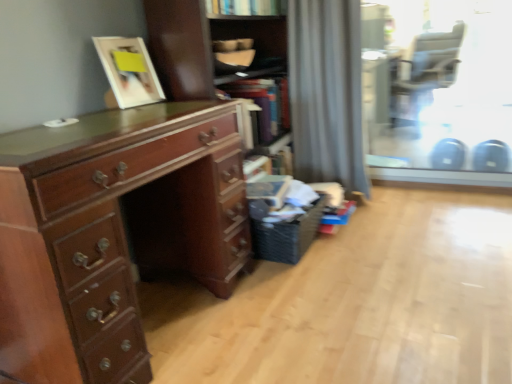
In order to click on matte black armchair at upper right in this screenshot , I will do `click(423, 73)`.

I want to click on shiny brown wooden desk at left, so click(112, 232).

Where is `transparent glass door at upper right`? transparent glass door at upper right is located at coordinates (438, 84).

Describe the element at coordinates (438, 84) in the screenshot. I see `transparent glass door at upper right` at that location.

Find the location of a particular element. The height and width of the screenshot is (384, 512). matte black armchair at upper right is located at coordinates (423, 73).

How many degrees apart are the facing directions of transparent glass door at upper right and gray fabric curtain at center?

The facing directions of transparent glass door at upper right and gray fabric curtain at center are 1.11 degrees apart.

Which is in front, transparent glass door at upper right or gray fabric curtain at center?

gray fabric curtain at center is more forward.

Is transparent glass door at upper right facing towards gray fabric curtain at center?

Yes, transparent glass door at upper right faces towards gray fabric curtain at center.

Between matte black armchair at upper right and transparent glass door at upper right, which one has smaller size?

Smaller between the two is transparent glass door at upper right.

Can you confirm if matte black armchair at upper right is thinner than transparent glass door at upper right?

No, matte black armchair at upper right is not thinner than transparent glass door at upper right.

Can you see matte black armchair at upper right touching transparent glass door at upper right?

matte black armchair at upper right is not next to transparent glass door at upper right, and they're not touching.

Who is smaller, gray fabric curtain at center or matte black armchair at upper right?

gray fabric curtain at center is smaller.

Which is more to the right, gray fabric curtain at center or matte black armchair at upper right?

matte black armchair at upper right.

Is gray fabric curtain at center far away from matte black armchair at upper right?

gray fabric curtain at center is far away from matte black armchair at upper right.

From a real-world perspective, between matte white picture frame at upper left and black woven laundry basket at lower right, who is vertically higher?

matte white picture frame at upper left is physically above.

Could you measure the distance between matte white picture frame at upper left and black woven laundry basket at lower right?

30.94 inches.

Relative to black woven laundry basket at lower right, is matte white picture frame at upper left in front or behind?

In the image, matte white picture frame at upper left appears in front of black woven laundry basket at lower right.

Can you tell me how much matte white picture frame at upper left and black woven laundry basket at lower right differ in facing direction?

There is a 9.55-degree angle between the facing directions of matte white picture frame at upper left and black woven laundry basket at lower right.

Would you say matte white picture frame at upper left is outside shiny brown wooden desk at left?

matte white picture frame at upper left lies outside shiny brown wooden desk at left's area.

What's the angular difference between matte white picture frame at upper left and shiny brown wooden desk at left's facing directions?

matte white picture frame at upper left and shiny brown wooden desk at left are facing 7.91 degrees away from each other.

Is matte white picture frame at upper left oriented away from shiny brown wooden desk at left?

No, matte white picture frame at upper left is not facing the opposite direction of shiny brown wooden desk at left.

Would you say matte white picture frame at upper left is a long distance from shiny brown wooden desk at left?

matte white picture frame at upper left is actually quite close to shiny brown wooden desk at left.

Can you confirm if wooden cabinet at center is wider than matte black armchair at upper right?

No, wooden cabinet at center is not wider than matte black armchair at upper right.

From a real-world perspective, which object rests below the other?

matte black armchair at upper right, from a real-world perspective.

Which is behind, wooden cabinet at center or matte black armchair at upper right?

matte black armchair at upper right is further from the camera.

Considering the positions of objects wooden cabinet at center and matte black armchair at upper right in the image provided, who is more to the right, wooden cabinet at center or matte black armchair at upper right?

matte black armchair at upper right is more to the right.

From a real-world perspective, relative to matte white picture frame at upper left, is wooden cabinet at center vertically above or below?

wooden cabinet at center is situated lower than matte white picture frame at upper left in the real world.

Is matte white picture frame at upper left surrounded by wooden cabinet at center?

Actually, matte white picture frame at upper left is outside wooden cabinet at center.

Which object is further away from the camera taking this photo, wooden cabinet at center or matte white picture frame at upper left?

wooden cabinet at center is further from the camera.

Identify the location of glass door behind the gray fabric curtain at center. (438, 84).

This screenshot has height=384, width=512. Identify the location of glass door on the left of matte black armchair at upper right. (438, 84).

Looking at the image, which one is located closer to black woven laundry basket at lower right, shiny brown wooden desk at left or gray fabric curtain at center?

The object closer to black woven laundry basket at lower right is shiny brown wooden desk at left.

In the scene shown: When comparing their distances from transparent glass door at upper right, does shiny brown wooden desk at left or gray fabric curtain at center seem further?

shiny brown wooden desk at left lies further to transparent glass door at upper right than the other object.

When comparing their distances from gray fabric curtain at center, does matte black armchair at upper right or matte white picture frame at upper left seem closer?

Among the two, matte white picture frame at upper left is located nearer to gray fabric curtain at center.

Looking at the image, which one is located further to wooden cabinet at center, black woven laundry basket at lower right or transparent glass door at upper right?

transparent glass door at upper right lies further to wooden cabinet at center than the other object.

From the image, which object appears to be farther from matte white picture frame at upper left, wooden cabinet at center or black woven laundry basket at lower right?

black woven laundry basket at lower right is further to matte white picture frame at upper left.

Looking at the image, which one is located further to transparent glass door at upper right, matte black armchair at upper right or black woven laundry basket at lower right?

black woven laundry basket at lower right lies further to transparent glass door at upper right than the other object.

Estimate the real-world distances between objects in this image. Which object is further from black woven laundry basket at lower right, matte white picture frame at upper left or wooden cabinet at center?

Based on the image, matte white picture frame at upper left appears to be further to black woven laundry basket at lower right.

From the image, which object appears to be nearer to black woven laundry basket at lower right, gray fabric curtain at center or transparent glass door at upper right?

gray fabric curtain at center lies closer to black woven laundry basket at lower right than the other object.

Where is `shelf between shiny brown wooden desk at left and matte black armchair at upper right in the front-back direction`? shelf between shiny brown wooden desk at left and matte black armchair at upper right in the front-back direction is located at coordinates (208, 46).

Where is `picture frame between shiny brown wooden desk at left and matte black armchair at upper right from front to back`? This screenshot has height=384, width=512. picture frame between shiny brown wooden desk at left and matte black armchair at upper right from front to back is located at coordinates (129, 71).

Locate an element on the screen. The width and height of the screenshot is (512, 384). glass door between black woven laundry basket at lower right and matte black armchair at upper right along the z-axis is located at coordinates (438, 84).

At what (x,y) coordinates should I click in order to perform the action: click on laundry basket between shiny brown wooden desk at left and gray fabric curtain at center along the z-axis. Please return your answer as a coordinate pair (x, y). Looking at the image, I should click on (287, 235).